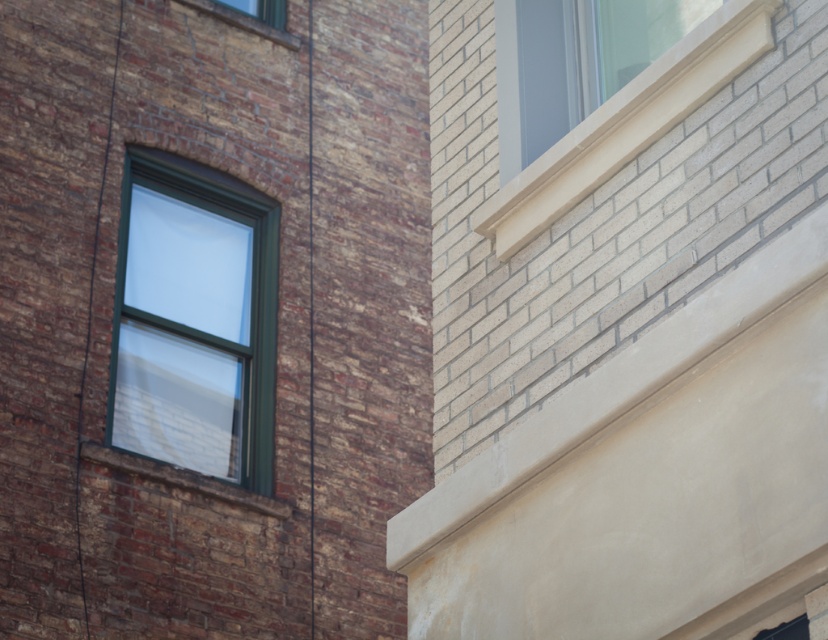
Question: Which of the following is the closest to the observer?

Choices:
 (A) (198, 8)
 (B) (147, 333)

Answer: (B)

Question: Considering the relative positions of green glass window at left and clear glass window at upper center in the image provided, where is green glass window at left located with respect to clear glass window at upper center?

Choices:
 (A) above
 (B) below

Answer: (B)

Question: Is green glass window at left behind white smooth window at upper right?

Choices:
 (A) yes
 (B) no

Answer: (A)

Question: Estimate the real-world distances between objects in this image. Which object is farther from the green glass window at left?

Choices:
 (A) white smooth window at upper right
 (B) clear glass window at upper center

Answer: (A)

Question: Can you confirm if green glass window at left is wider than clear glass window at upper center?

Choices:
 (A) no
 (B) yes

Answer: (B)

Question: Which object appears closest to the camera in this image?

Choices:
 (A) white smooth window at upper right
 (B) clear glass window at upper center
 (C) green glass window at left

Answer: (A)